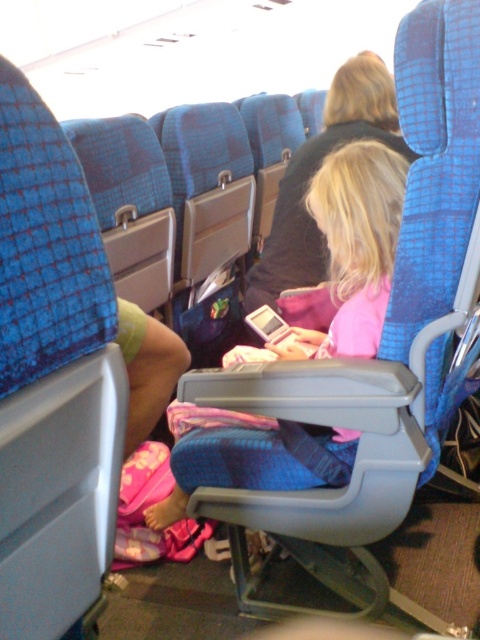
You are sitting in an airplane seat and notice two items at center in the scene. The pink fabric at center and the dark blue fabric jacket at center. Which one is closer to you?

The pink fabric at center is closer to the viewer than the dark blue fabric jacket at center.

Consider the image. You are a flight attendant checking seatbelts. You notice the pink fabric at center and the dark blue fabric jacket at center. Which one is closer to the floor?

The pink fabric at center is below the dark blue fabric jacket at center, so the pink fabric at center is closer to the floor.